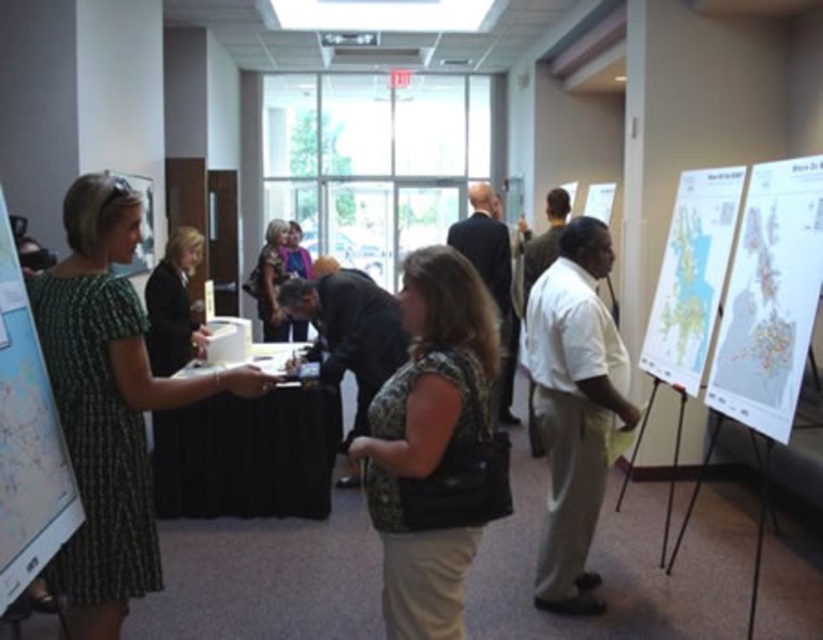
You are organizing a presentation in the conference room and need to place two items on the table. The white paper map at right and the white paperboard poster at upper right. Which item requires more space on the table?

The white paperboard poster at upper right requires more space on the table because it is larger than the white paper map at right.